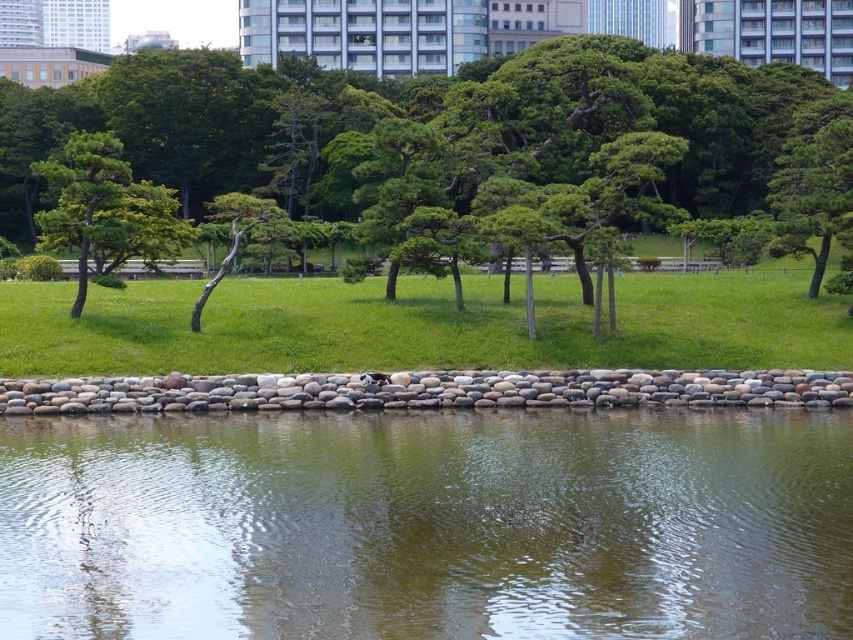
You are standing at the point marked as point (415, 120) in the park. What is the nearest object to you?

The nearest object to you is the green leafy tree at center, as the point (415, 120) is located on it.

You are planning to place a picnic blanket in the park. The blanket is 2 meters wide. You have two options for placement areas based on the image. One is the green grass at center and the other is the green textured tree at upper right. Which area can accommodate the blanket without folding it?

The green grass at center has a greater width than the green textured tree at upper right, so placing the picnic blanket there would allow it to fit without folding.